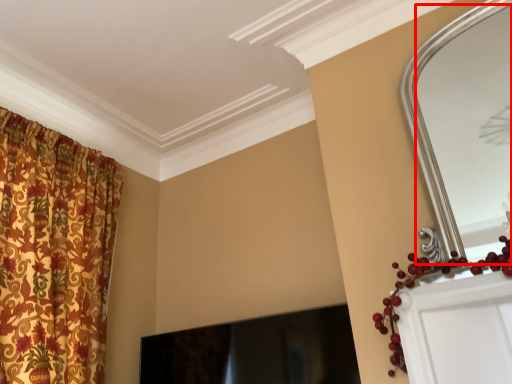
Question: Observing the image, what is the correct spatial positioning of mirror (annotated by the red box) in reference to fireplace?

Choices:
 (A) right
 (B) left

Answer: (A)